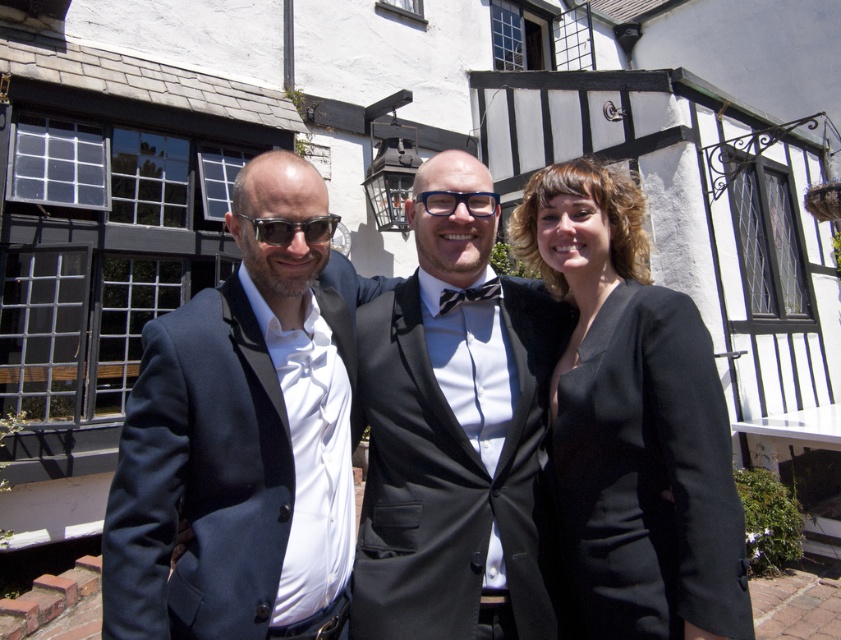
You are a photographer setting up a tripod to take a group photo of the matte black suit at center and blue plastic glasses at center. The tripod has a height adjustment limit of 1.8 meters. Can you position the camera so that both subjects are in focus without adjusting the height beyond the limit?

The matte black suit at center is much taller than the blue plastic glasses at center. Since the tripod can be adjusted up to 1.8 meters, you can position the camera at a height that accommodates both subjects within the frame without exceeding the limit.

You are standing at the point with coordinates point (445,202) and want to walk towards the building entrance located at point (532,300). Will you be moving forward or backward relative to your current position?

Since point (532,300) is behind point (445,202), moving towards it would mean you are walking backward relative to your current position.